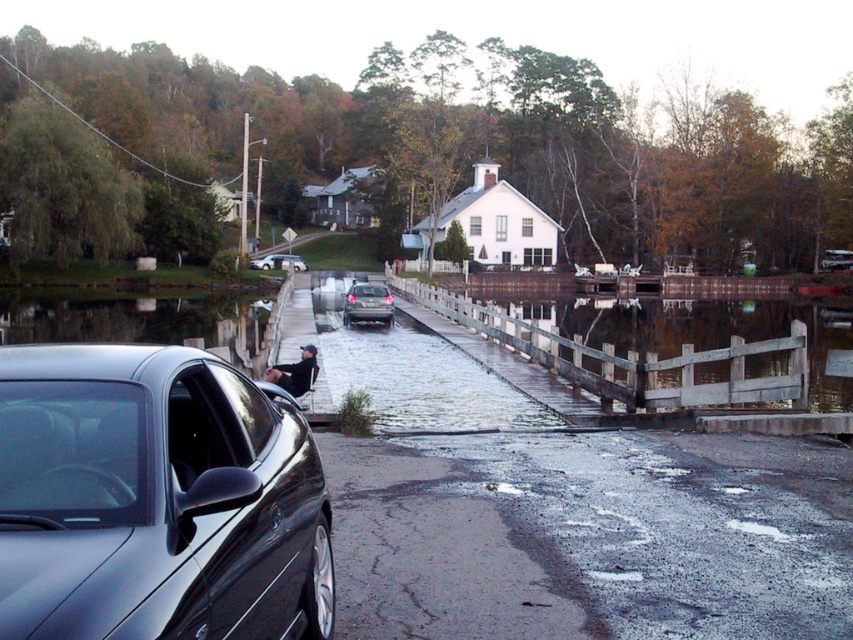
Is slick asphalt flood at center shorter than satin silver sedan at center?

Incorrect, slick asphalt flood at center's height does not fall short of satin silver sedan at center's.

Based on the photo, is slick asphalt flood at center below satin silver sedan at center?

Yes, slick asphalt flood at center is below satin silver sedan at center.

Consider the image. Who is more distant from viewer, (480, 426) or (368, 291)?

The point (368, 291) is behind.

This screenshot has height=640, width=853. Identify the location of slick asphalt flood at center. (412, 372).

Between wooden fence at center and metallic silver car at center, which one is positioned higher?

metallic silver car at center

Does wooden fence at center come in front of metallic silver car at center?

Yes, wooden fence at center is in front of metallic silver car at center.

Does point (816, 316) come farther from viewer compared to point (850, 252)?

No, it is not.

Identify the location of wooden fence at center. The image size is (853, 640). (682, 355).

Between glossy black car at center and wooden fence at center, which one is positioned higher?

wooden fence at center

What do you see at coordinates (155, 499) in the screenshot? I see `glossy black car at center` at bounding box center [155, 499].

Between point (9, 422) and point (469, 307), which one is positioned behind?

The point (469, 307) is more distant.

Where is `glossy black car at center`? The height and width of the screenshot is (640, 853). glossy black car at center is located at coordinates (155, 499).